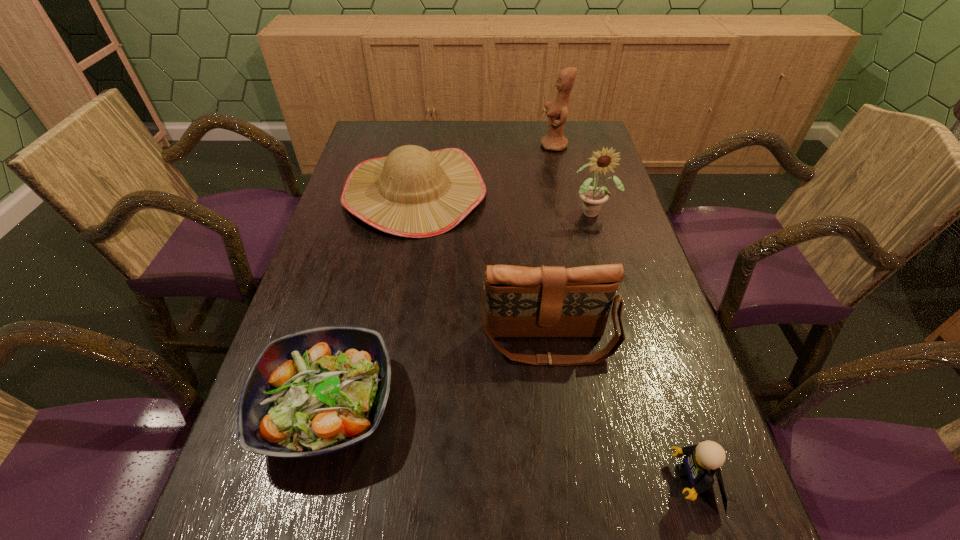
Where is `the farthest object`? the farthest object is located at coordinates (557, 111).

Identify the location of the tallest object. This screenshot has height=540, width=960. (557, 111).

Find the location of `sunflower`. sunflower is located at coordinates (592, 198).

Find the location of `shoulder bag`. shoulder bag is located at coordinates (521, 301).

I want to click on the fourth tallest object, so click(x=413, y=192).

Identify the location of Lego. (702, 461).

This screenshot has width=960, height=540. I want to click on salad plate, so click(x=318, y=391).

At what (x,y) coordinates should I click in order to perform the action: click on vacant region located 0.180m on the front-facing side of the figurine. Please return your answer as a coordinate pair (x, y). The width and height of the screenshot is (960, 540). Looking at the image, I should click on (487, 146).

I want to click on vacant point located on the front-facing side of the figurine, so click(468, 146).

This screenshot has width=960, height=540. I want to click on free space located 0.090m on the front-facing side of the figurine, so click(x=514, y=146).